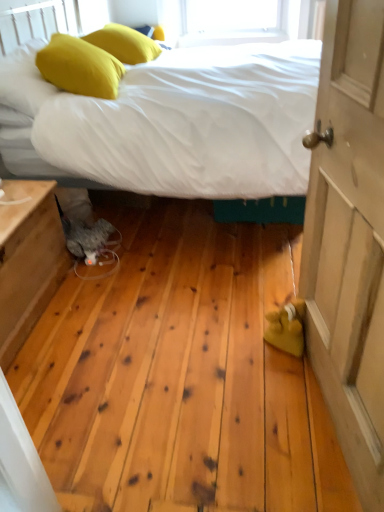
Question: In terms of size, does wooden nightstand at lower left appear bigger or smaller than yellow fabric pillow at upper left, which ranks as the 1th pillow in bottom-to-top order?

Choices:
 (A) small
 (B) big

Answer: (B)

Question: Is point (34, 264) closer or farther from the camera than point (77, 60)?

Choices:
 (A) closer
 (B) farther

Answer: (A)

Question: Which is nearer to the yellow fabric pillow at upper left, which ranks as the 1th pillow in bottom-to-top order?

Choices:
 (A) yellow fabric pillow at upper left, marked as the 2th pillow in a bottom-to-top arrangement
 (B) wooden door at right
 (C) wooden nightstand at lower left
 (D) white fabric bed at center

Answer: (D)

Question: Based on their relative distances, which object is nearer to the yellow fabric pillow at upper left, the 1th pillow when ordered from back to front?

Choices:
 (A) wooden nightstand at lower left
 (B) yellow fabric pillow at upper left, placed as the 2th pillow when sorted from top to bottom
 (C) white fabric bed at center
 (D) wooden door at right

Answer: (B)